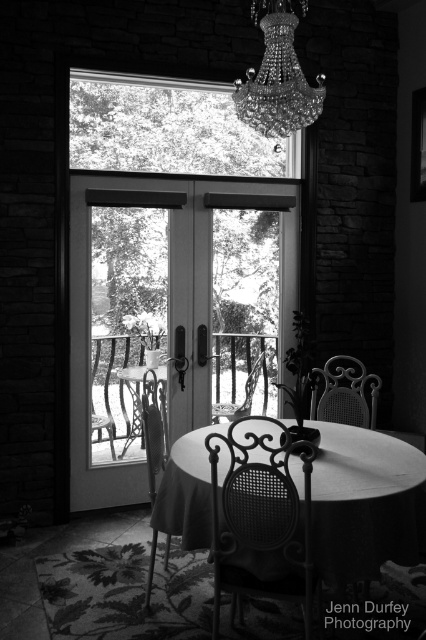
Between metallic glass door at center and smooth matte black table at center, which one appears on the left side from the viewer's perspective?

metallic glass door at center

Does metallic glass door at center have a lesser height compared to smooth matte black table at center?

No, metallic glass door at center is not shorter than smooth matte black table at center.

Image resolution: width=426 pixels, height=640 pixels. What do you see at coordinates (169, 294) in the screenshot?
I see `metallic glass door at center` at bounding box center [169, 294].

This screenshot has width=426, height=640. Identify the location of metallic glass door at center. (169, 294).

Does metallic glass door at center have a greater width compared to metallic wrought iron table at center?

Indeed, metallic glass door at center has a greater width compared to metallic wrought iron table at center.

Is metallic glass door at center smaller than metallic wrought iron table at center?

No.

Is point (184, 285) positioned after point (140, 426)?

No, it is not.

Where is `metallic glass door at center`? metallic glass door at center is located at coordinates (169, 294).

Does woven rattan chair at lower center appear over metallic wrought iron table at center?

Correct, woven rattan chair at lower center is located above metallic wrought iron table at center.

Is woven rattan chair at lower center smaller than metallic wrought iron table at center?

Actually, woven rattan chair at lower center might be larger than metallic wrought iron table at center.

This screenshot has height=640, width=426. Describe the element at coordinates (345, 392) in the screenshot. I see `woven rattan chair at lower center` at that location.

Locate an element on the screen. woven rattan chair at lower center is located at coordinates (345, 392).